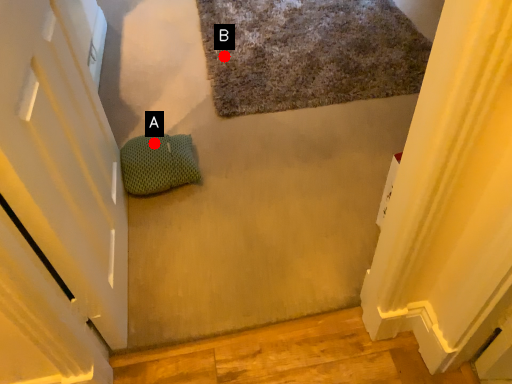
Question: Two points are circled on the image, labeled by A and B beside each circle. Among these points, which one is farthest from the camera?

Choices:
 (A) A is further
 (B) B is further

Answer: (B)